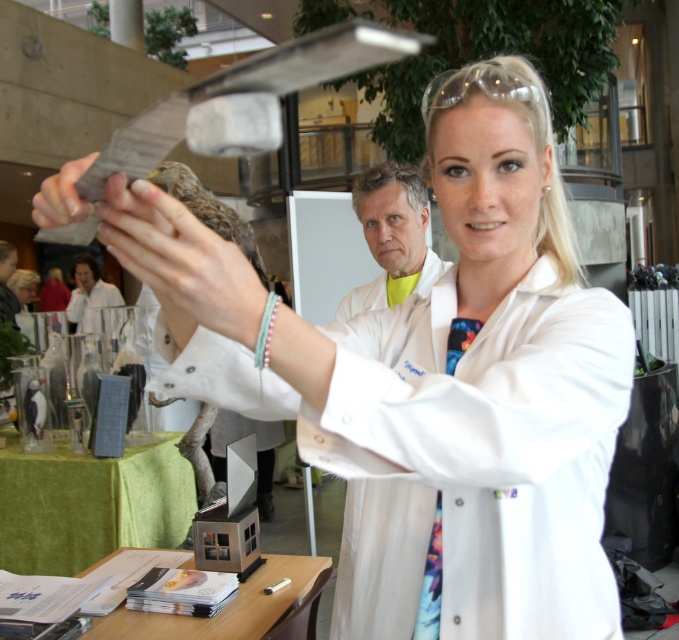
You are organizing an exhibit and need to place a label next to the yellow fabric at center and the matte silver bird at center. Which object should the label for the smaller item be placed near?

The yellow fabric at center has a smaller size compared to the matte silver bird at center, so the label for the smaller item should be placed near the yellow fabric at center.

You are an event organizer who needs to decide whether to place a 10cm wide decorative item between the yellow fabric at center and the matte black glove at upper left. Based on their widths, can the item fit between them?

The yellow fabric at center might be wider than matte black glove at upper left, so the 10cm wide decorative item may or may not fit between them depending on the exact width difference. Further measurement is needed.

You are a participant at this event and need to reach both the yellow fabric at center and the matte black glove at upper left. Which object should you approach first to touch the one closer to you?

You should first touch the yellow fabric at center because it is closer to you than the matte black glove at upper left.